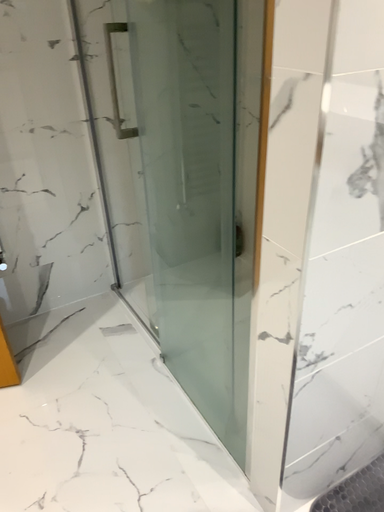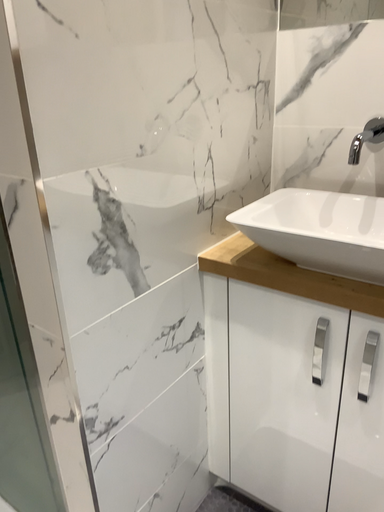
Question: Which way did the camera rotate in the video?

Choices:
 (A) rotated upward
 (B) rotated downward

Answer: (A)